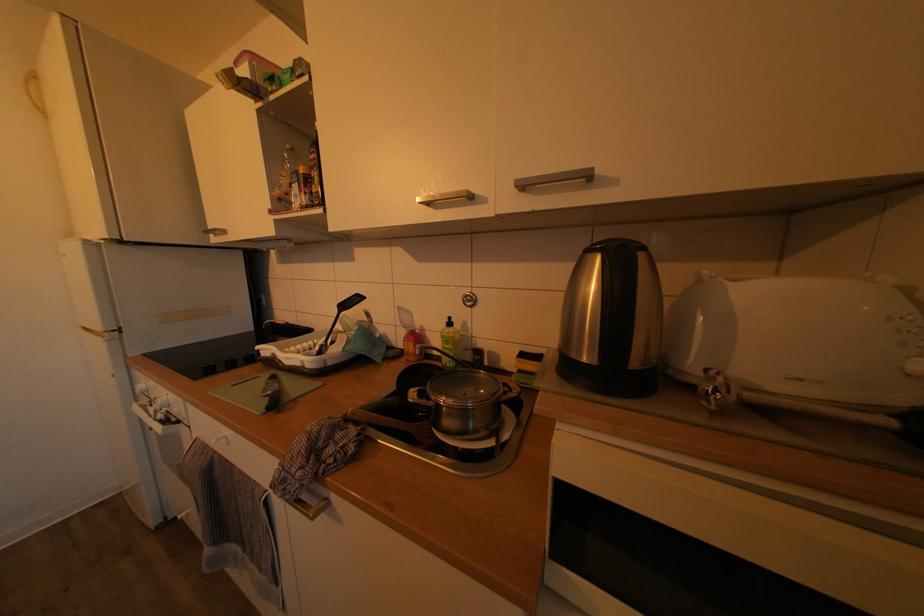
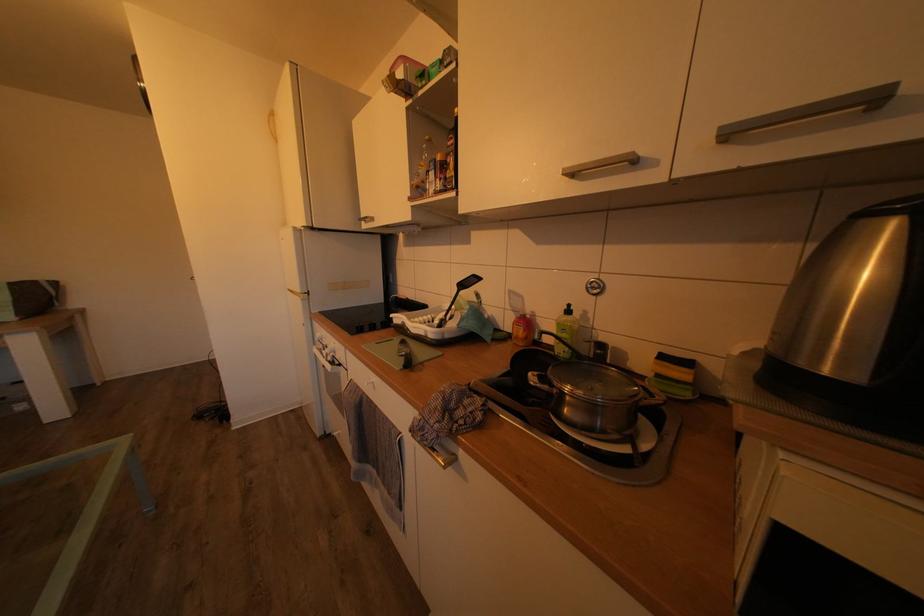
The point at (524, 188) is marked in the first image. Where is the corresponding point in the second image?

(728, 134)